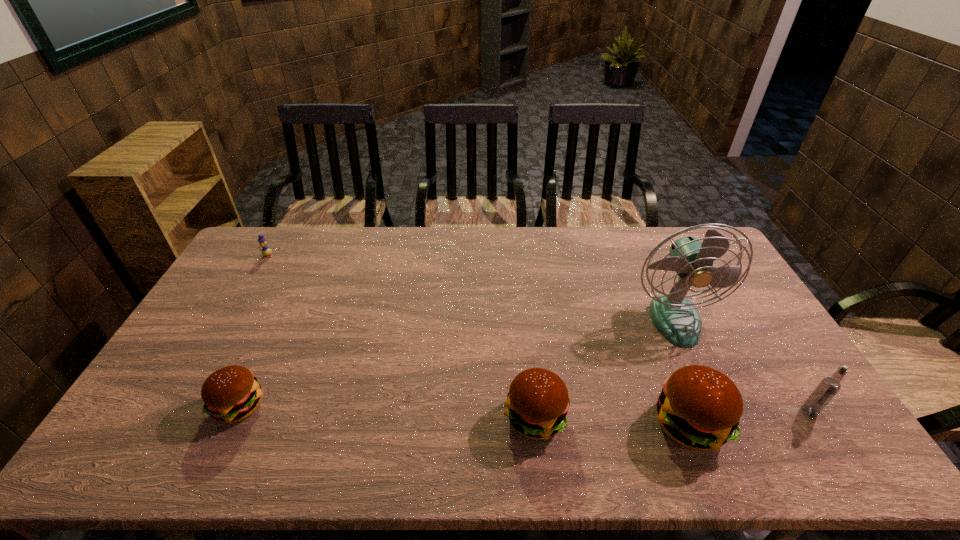
Where is `object that is positioned at the far left corner`? The height and width of the screenshot is (540, 960). object that is positioned at the far left corner is located at coordinates (265, 251).

At what (x,y) coordinates should I click in order to perform the action: click on object that is at the near right corner. Please return your answer as a coordinate pair (x, y). Image resolution: width=960 pixels, height=540 pixels. Looking at the image, I should click on (829, 386).

This screenshot has height=540, width=960. I want to click on vacant region at the far edge of the desktop, so click(456, 229).

This screenshot has height=540, width=960. I want to click on blank space at the left edge of the desktop, so click(254, 274).

This screenshot has height=540, width=960. Find the location of `free space at the far left corner of the desktop`. free space at the far left corner of the desktop is located at coordinates (273, 252).

Identify the location of vacant space at the near right corner of the desktop. (804, 417).

Image resolution: width=960 pixels, height=540 pixels. I want to click on unoccupied position between the fan and the vodka, so click(741, 365).

Where is `empty space between the rightmost hamburger and the fifth tallest object`? The width and height of the screenshot is (960, 540). empty space between the rightmost hamburger and the fifth tallest object is located at coordinates click(x=464, y=415).

Where is `free space that is in between the second object from left to right and the tallest object`? free space that is in between the second object from left to right and the tallest object is located at coordinates (457, 363).

This screenshot has width=960, height=540. Find the location of `free area in between the shortest object and the third object from left to right`. free area in between the shortest object and the third object from left to right is located at coordinates (401, 337).